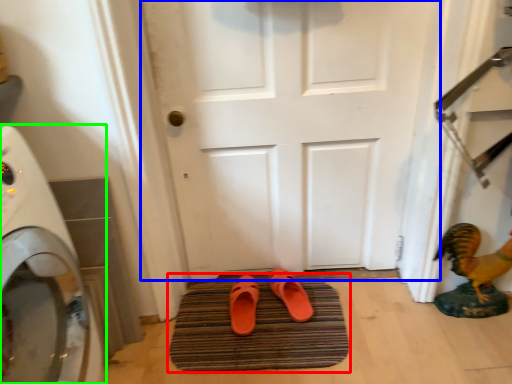
Question: Estimate the real-world distances between objects in this image. Which object is farther from bath mat (highlighted by a red box), door (highlighted by a blue box) or home appliance (highlighted by a green box)?

Choices:
 (A) door
 (B) home appliance

Answer: (B)